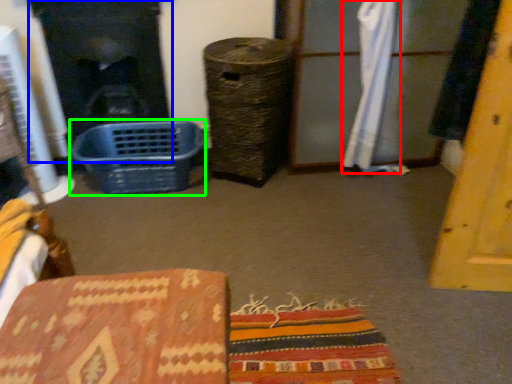
Question: Which object is the closest to the curtain (highlighted by a red box)? Choose among these: fireplace (highlighted by a blue box) or basket (highlighted by a green box).

Choices:
 (A) fireplace
 (B) basket

Answer: (B)